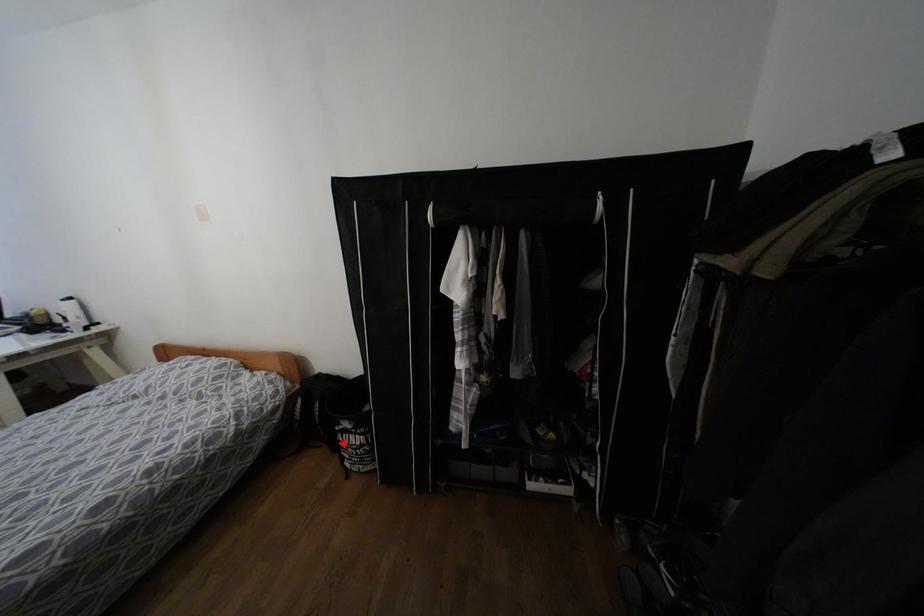
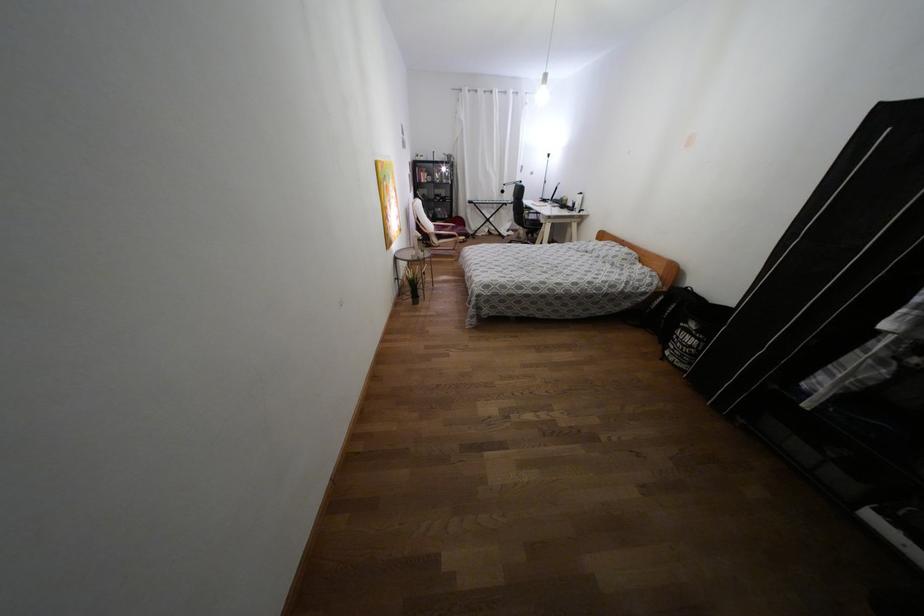
Find the pixel in the second image that matches the highlighted location in the first image.

(676, 337)